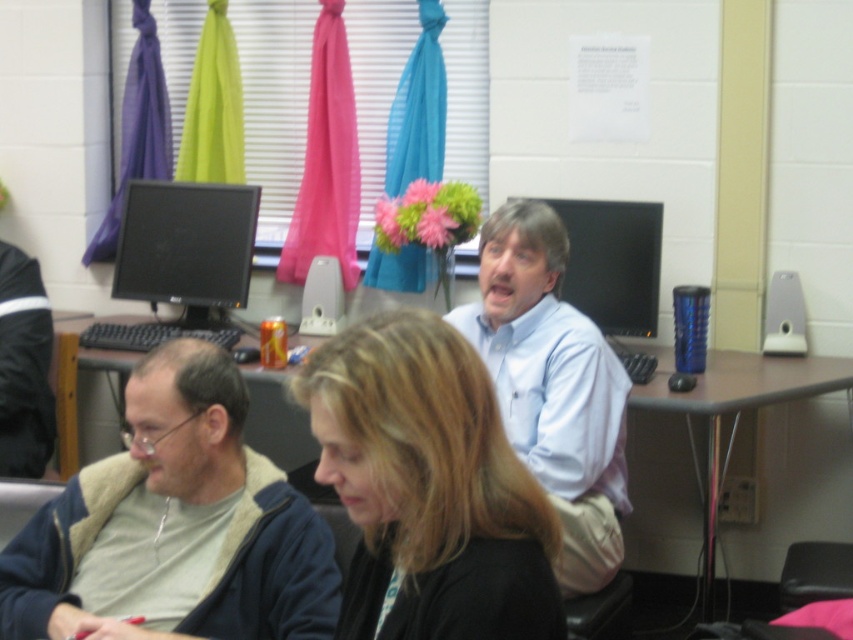
Question: Which object appears farthest from the camera in this image?

Choices:
 (A) black matte hair at center
 (B) matte black monitor at center
 (C) black glossy monitor at upper left
 (D) blue fleece jacket at lower left

Answer: (C)

Question: Which of these objects is positioned closest to the black glossy monitor at upper left?

Choices:
 (A) blue fleece jacket at lower left
 (B) light blue shirt at center

Answer: (B)

Question: Which of the following is the closest to the observer?

Choices:
 (A) (160, 273)
 (B) (602, 237)

Answer: (B)

Question: Observing the image, what is the correct spatial positioning of black matte hair at center in reference to matte black monitor at center?

Choices:
 (A) right
 (B) left

Answer: (B)

Question: Is black glossy monitor at upper left to the right of matte black monitor at center from the viewer's perspective?

Choices:
 (A) yes
 (B) no

Answer: (B)

Question: Does blue fleece jacket at lower left appear over brown wood table at center?

Choices:
 (A) yes
 (B) no

Answer: (A)